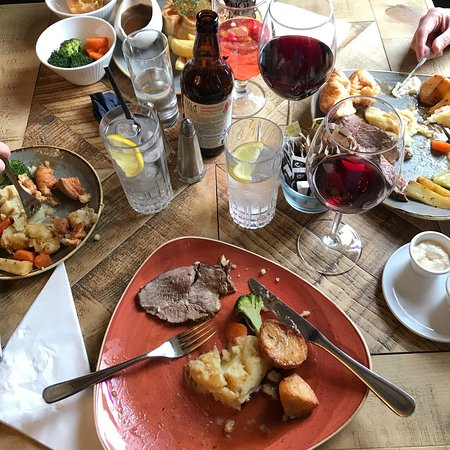
The image size is (450, 450). Find the location of `napkin`. napkin is located at coordinates (35, 358).